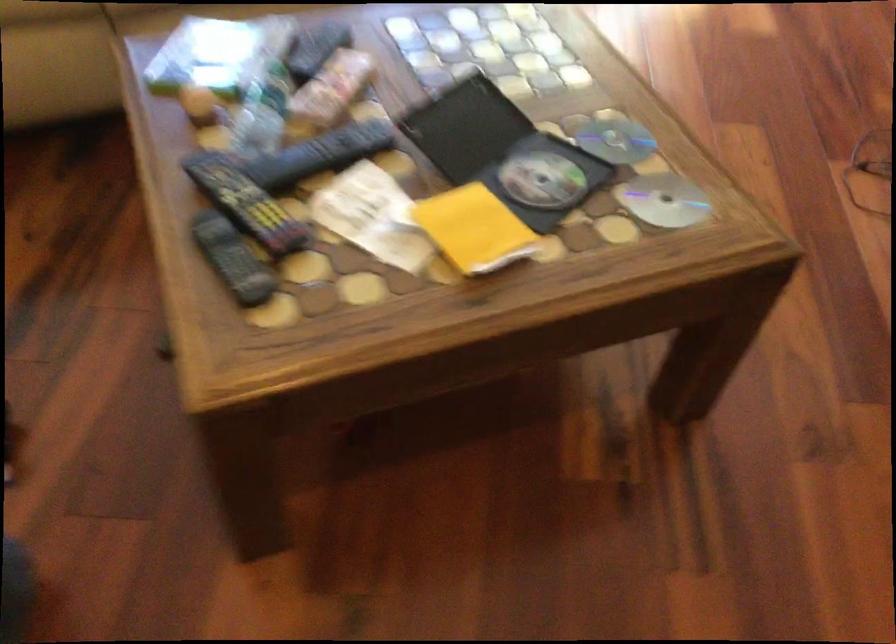
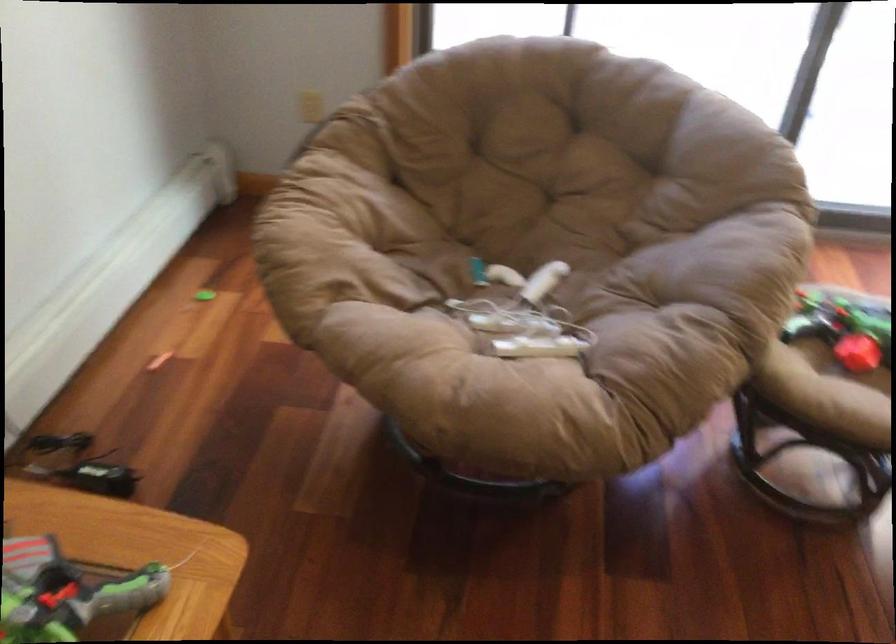
Question: The images are taken continuously from a first-person perspective. In which direction are you moving?

Choices:
 (A) Left
 (B) Right
 (C) Forward
 (D) Backward

Answer: (A)